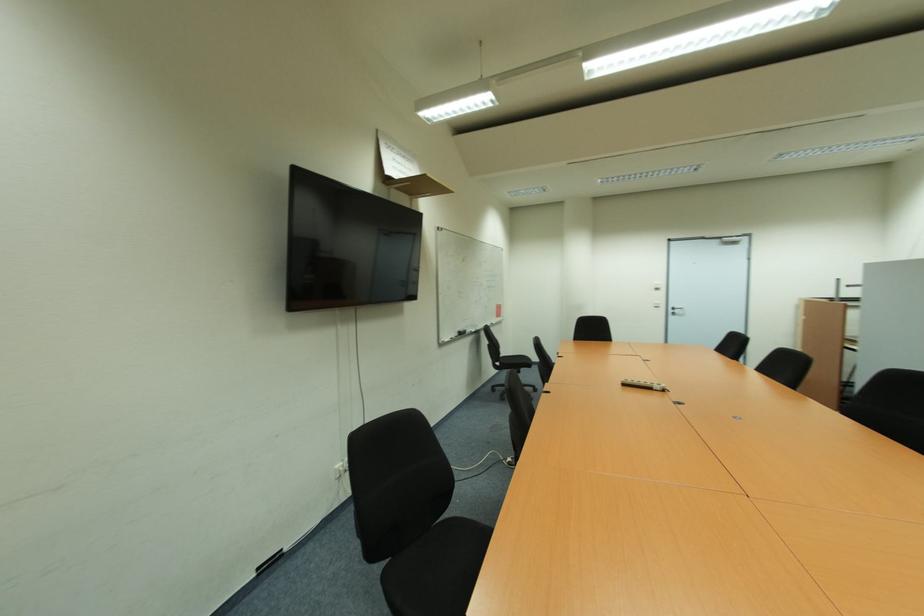
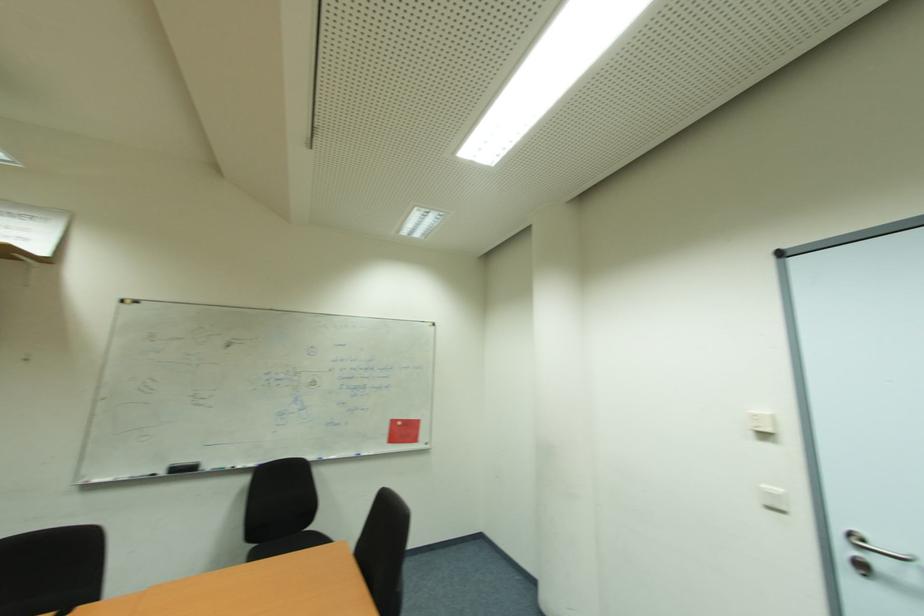
Where in the second image is the point corresponding to (466,334) from the first image?

(189, 469)